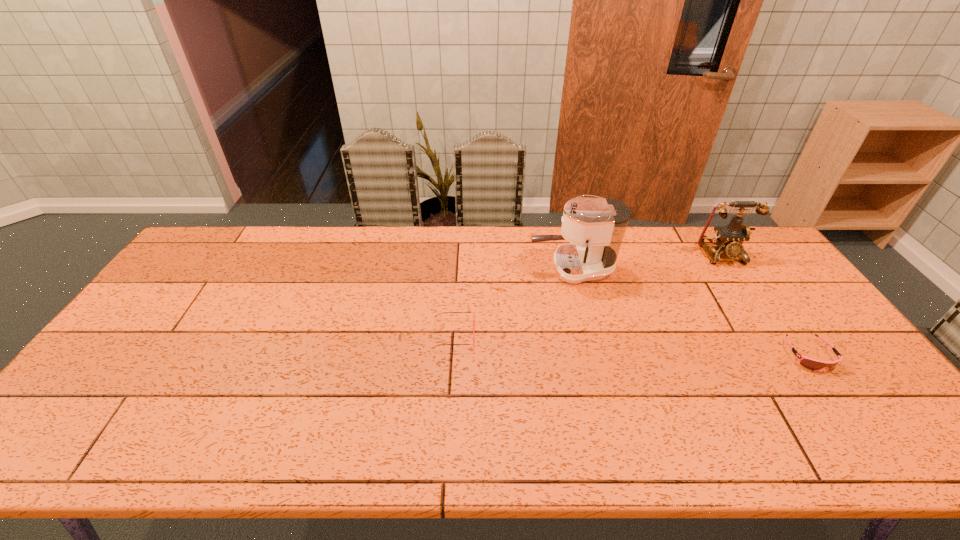
The image size is (960, 540). In order to click on the third object from right to left in this screenshot , I will do `click(595, 227)`.

You are a GUI agent. You are given a task and a screenshot of the screen. Output one action in this format:
    pyautogui.click(x=<x>, y=<y>)
    Task: Click on the tallest object
    The height and width of the screenshot is (540, 960).
    Given the screenshot: What is the action you would take?
    pyautogui.click(x=595, y=227)

Locate an element on the screen. The height and width of the screenshot is (540, 960). the second tallest object is located at coordinates (729, 239).

This screenshot has width=960, height=540. Identify the location of the leftmost object. click(x=442, y=312).

Image resolution: width=960 pixels, height=540 pixels. I want to click on goggles, so click(809, 363).

This screenshot has height=540, width=960. In order to click on vacant region located 0.090m on the front-facing side of the third object from right to left in this screenshot , I will do `click(501, 269)`.

Image resolution: width=960 pixels, height=540 pixels. I want to click on free point located on the front-facing side of the third object from right to left, so click(x=425, y=269).

Locate an element on the screen. vacant space located 0.330m on the front-facing side of the third object from right to left is located at coordinates (428, 269).

In order to click on blank area located on the front of the telephone, featuring the rotary dial in this screenshot , I will do `click(747, 293)`.

Identify the location of free spot located on the front-facing side of the leftmost object. The width and height of the screenshot is (960, 540). (603, 334).